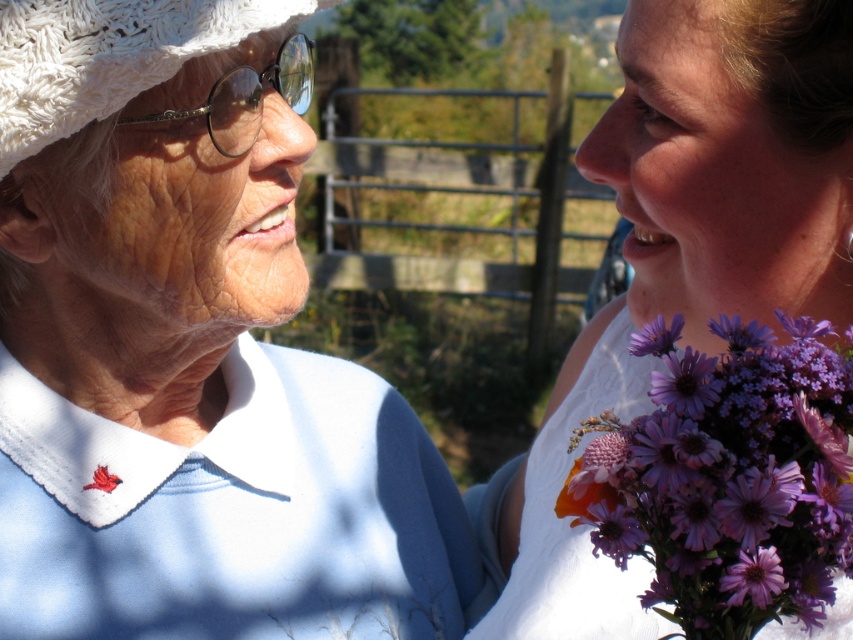
Question: Considering the relative positions of white cotton blouse at left and white textured hat at left in the image provided, where is white cotton blouse at left located with respect to white textured hat at left?

Choices:
 (A) below
 (B) above

Answer: (A)

Question: Among these objects, which one is nearest to the camera?

Choices:
 (A) white textured hat at upper left
 (B) purple matte flower at upper right

Answer: (B)

Question: Can you confirm if purple floral bouquet at right is bigger than purple matte flower at center?

Choices:
 (A) no
 (B) yes

Answer: (B)

Question: Which object appears closest to the camera in this image?

Choices:
 (A) purple matte flower at center
 (B) white textured hat at left
 (C) purple matte flower at upper right

Answer: (A)

Question: Which object is farther from the camera taking this photo?

Choices:
 (A) purple floral bouquet at right
 (B) white textured hat at upper left
 (C) purple matte flower at center

Answer: (B)

Question: Is white cotton blouse at left smaller than purple floral bouquet at right?

Choices:
 (A) no
 (B) yes

Answer: (A)